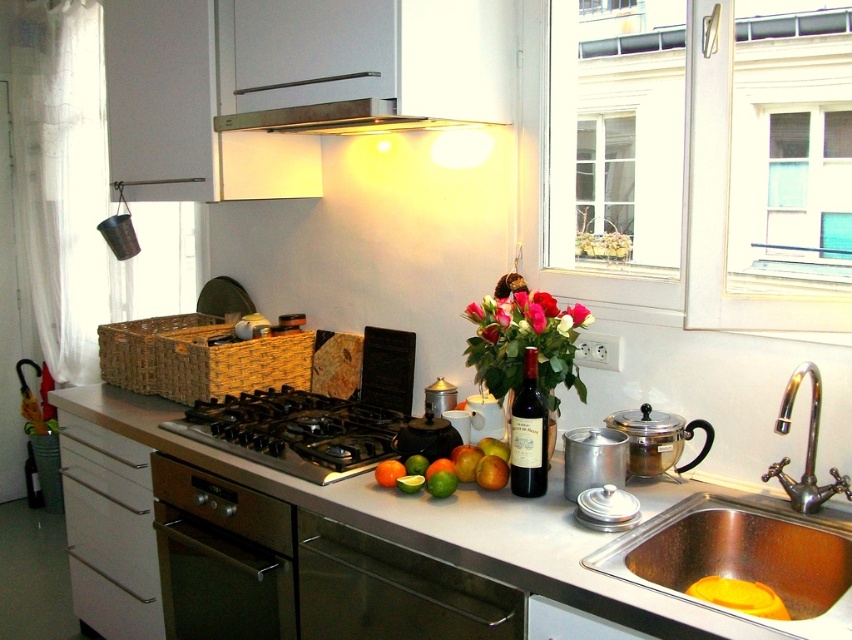
Question: Does polished chrome faucet at sink right appear under orange matte at center?

Choices:
 (A) no
 (B) yes

Answer: (A)

Question: Which of the following is the farthest from the observer?

Choices:
 (A) glossy citrus fruits at center
 (B) stainless steel dishwasher at lower center

Answer: (A)

Question: Can you confirm if stainless steel sink at lower right is positioned below stainless steel pot at center?

Choices:
 (A) yes
 (B) no

Answer: (A)

Question: Which is nearer to the stainless steel gas stove at center?

Choices:
 (A) green matte lime at center
 (B) vivid floral bouquet at center
 (C) stainless steel dishwasher at lower center
 (D) stainless steel counter at center

Answer: (D)

Question: From the image, what is the correct spatial relationship of clear glass window at upper right in relation to brushed metal kettle at center?

Choices:
 (A) below
 (B) above

Answer: (B)

Question: Which of the following is the closest to the observer?

Choices:
 (A) (671, 564)
 (B) (844, 627)

Answer: (B)